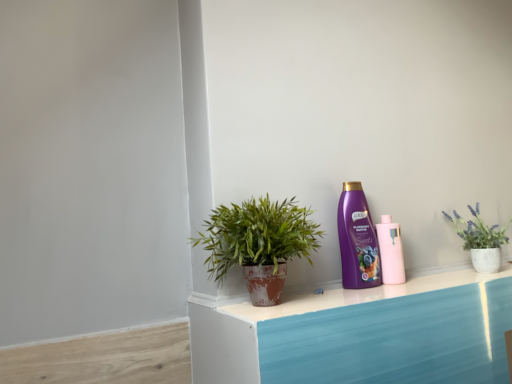
Question: Is terracotta pot plant at center with purple plastic bottle at center-right, arranged as the 2th bottle when viewed from the right?

Choices:
 (A) no
 (B) yes

Answer: (A)

Question: From the image's perspective, is terracotta pot plant at center located beneath purple plastic bottle at center-right, arranged as the 2th bottle when viewed from the right?

Choices:
 (A) yes
 (B) no

Answer: (B)

Question: Can you confirm if terracotta pot plant at center is thinner than purple plastic bottle at center-right, arranged as the 2th bottle when viewed from the right?

Choices:
 (A) yes
 (B) no

Answer: (B)

Question: From a real-world perspective, is terracotta pot plant at center below purple plastic bottle at center-right, arranged as the 2th bottle when viewed from the right?

Choices:
 (A) yes
 (B) no

Answer: (A)

Question: Is terracotta pot plant at center oriented towards purple plastic bottle at center-right, arranged as the 2th bottle when viewed from the right?

Choices:
 (A) no
 (B) yes

Answer: (A)

Question: From a real-world perspective, is purple plastic bottle at center-right, arranged as the 1th bottle when viewed from the left, positioned above or below terracotta pot plant at center?

Choices:
 (A) above
 (B) below

Answer: (A)

Question: Would you say purple plastic bottle at center-right, arranged as the 2th bottle when viewed from the right, is to the left or to the right of terracotta pot plant at center in the picture?

Choices:
 (A) left
 (B) right

Answer: (B)

Question: Is point (371, 264) closer or farther from the camera than point (303, 241)?

Choices:
 (A) closer
 (B) farther

Answer: (B)

Question: Looking at the image, does purple plastic bottle at center-right, arranged as the 2th bottle when viewed from the right, seem bigger or smaller compared to terracotta pot plant at center?

Choices:
 (A) small
 (B) big

Answer: (A)

Question: Is pink matte bottle at center-right, which appears as the 1th bottle when viewed from the right, bigger or smaller than purple plastic bottle at center-right, arranged as the 2th bottle when viewed from the right?

Choices:
 (A) small
 (B) big

Answer: (A)

Question: In the image, is pink matte bottle at center-right, which appears as the 1th bottle when viewed from the right, positioned in front of or behind purple plastic bottle at center-right, arranged as the 1th bottle when viewed from the left?

Choices:
 (A) behind
 (B) front

Answer: (A)

Question: Is pink matte bottle at center-right, which appears as the second bottle when viewed from the left, inside or outside of purple plastic bottle at center-right, arranged as the 2th bottle when viewed from the right?

Choices:
 (A) inside
 (B) outside

Answer: (B)

Question: Is pink matte bottle at center-right, which appears as the 1th bottle when viewed from the right, taller or shorter than purple plastic bottle at center-right, arranged as the 2th bottle when viewed from the right?

Choices:
 (A) short
 (B) tall

Answer: (A)

Question: In terms of size, does terracotta pot plant at center appear bigger or smaller than pink matte bottle at center-right, which appears as the 1th bottle when viewed from the right?

Choices:
 (A) big
 (B) small

Answer: (A)

Question: In terms of width, does terracotta pot plant at center look wider or thinner when compared to pink matte bottle at center-right, which appears as the 1th bottle when viewed from the right?

Choices:
 (A) wide
 (B) thin

Answer: (A)